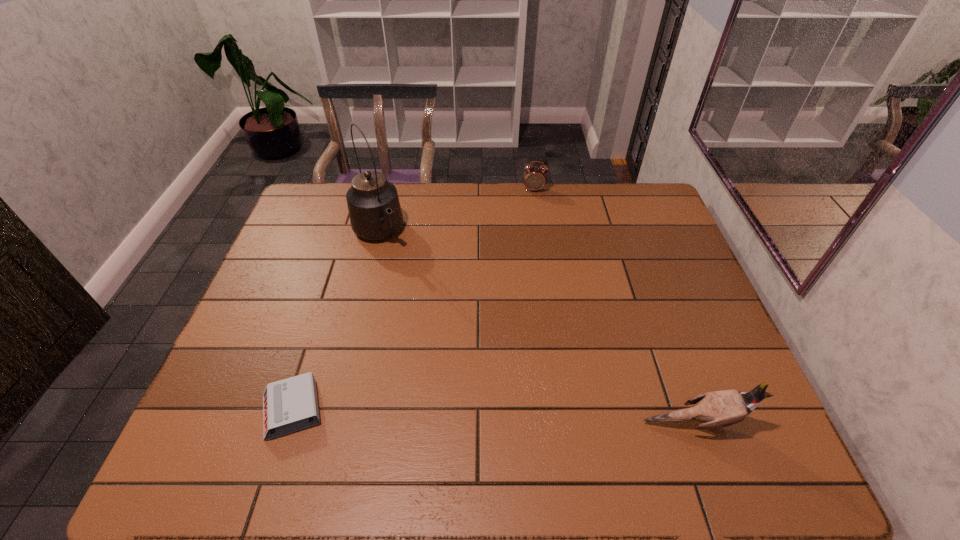
Choose which object is the third nearest neighbor to the second shortest object. Please provide its 2D coordinates. Your answer should be formatted as a tuple, i.e. [(x, y)], where the tuple contains the x and y coordinates of a point satisfying the conditions above.

[(289, 405)]

Locate an element on the screen. Image resolution: width=960 pixels, height=540 pixels. vacant space that satisfies the following two spatial constraints: 1. on the back side of the shortest object; 2. on the left side of the second farthest object is located at coordinates point(348,233).

At what (x,y) coordinates should I click in order to perform the action: click on free location that satisfies the following two spatial constraints: 1. on the back side of the left alarm clock; 2. on the right side of the kettle. Please return your answer as a coordinate pair (x, y). The height and width of the screenshot is (540, 960). Looking at the image, I should click on (348, 233).